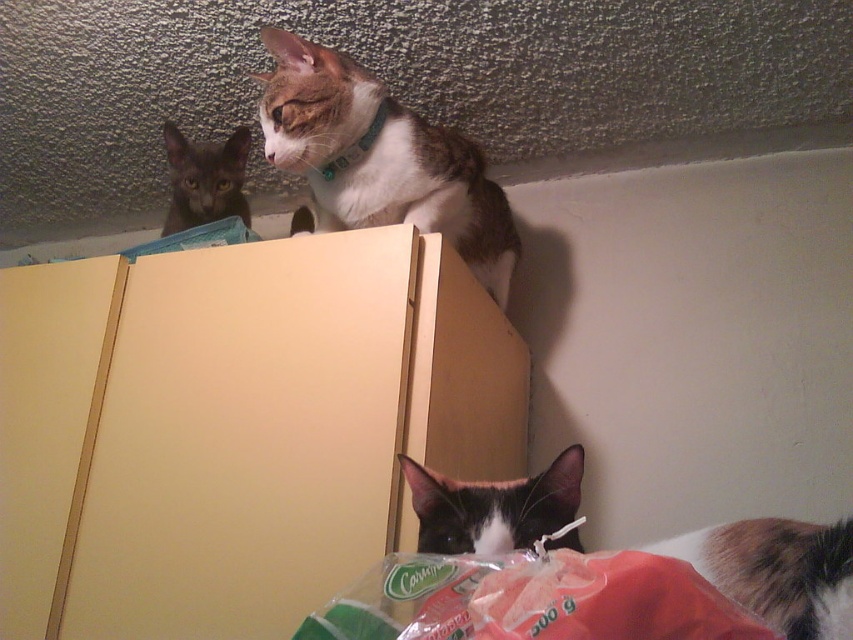
From the picture: You are a cat owner trying to locate your two cats in the room. You see the brown and white fur at upper center and the dark gray fur at upper left. Which cat is closer to you?

The brown and white fur at upper center is closer to the viewer than the dark gray fur at upper left.

You are standing in the room and see the black and white fur cat at lower right and the black fur cat at lower center. Which cat is positioned more to your right side?

The black and white fur cat at lower right is positioned more to the right side than the black fur cat at lower center.

What does the point at coordinates point [380,157] in the image represent?

The point at coordinates point [380,157] corresponds to brown and white fur at upper center.